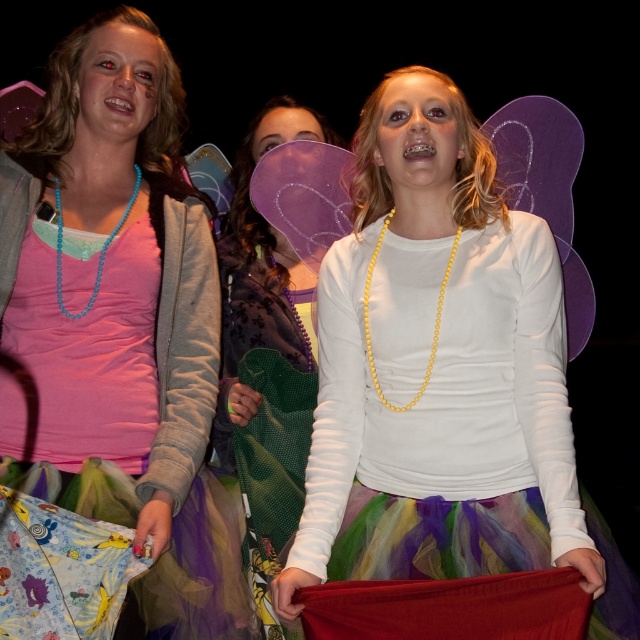
Based on the coordinates provided, where is the yellow beaded necklace at center located in the image?

The yellow beaded necklace at center is located at the coordinates point (433, 324) in the image.

You are a photographer adjusting your camera settings to capture a closeup of the yellow beaded necklace at center. Given that the camera can focus on objects within 5 feet, will you need to move closer or farther away to get a clear shot?

The yellow beaded necklace at center is 6.47 feet from the camera, which is beyond the 5 feet focus range. To get a clear shot, you need to move closer to reduce the distance to within 5 feet.